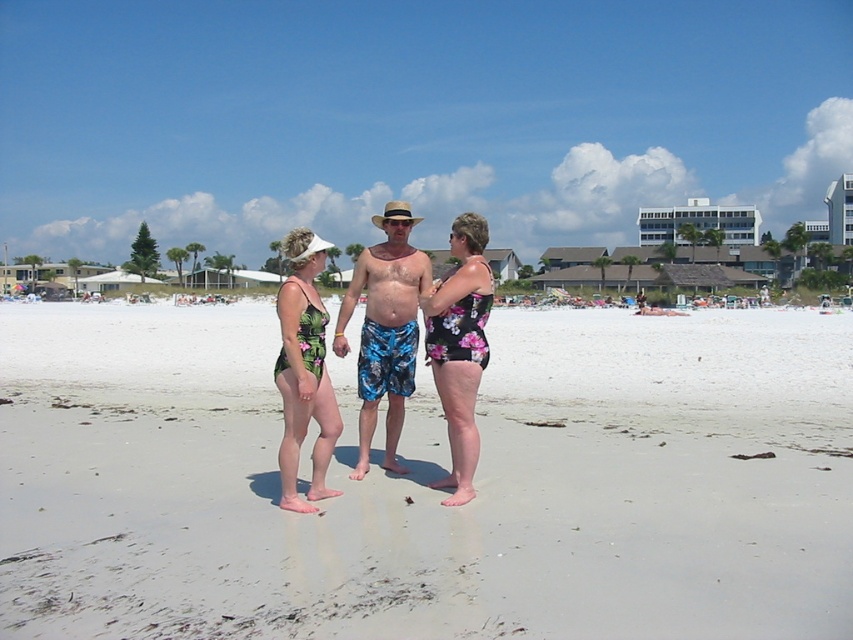
Who is more distant from viewer, (428, 419) or (322, 440)?

Positioned behind is point (428, 419).

Which of these two, white sand at center or green floral swimsuit at center, stands taller?

With more height is green floral swimsuit at center.

Identify the location of white sand at center. (428, 481).

Where is `white sand at center`? The width and height of the screenshot is (853, 640). white sand at center is located at coordinates (428, 481).

Based on the photo, is floral print swimsuit at center positioned in front of black plastic goggles at center?

That is True.

Does floral print swimsuit at center have a larger size compared to black plastic goggles at center?

Indeed, floral print swimsuit at center has a larger size compared to black plastic goggles at center.

Who is more distant from viewer, (x=471, y=212) or (x=409, y=224)?

The point (x=471, y=212) is behind.

Locate an element on the screen. Image resolution: width=853 pixels, height=640 pixels. floral print swimsuit at center is located at coordinates (459, 348).

Can you confirm if white sand at center is shorter than blue printed shorts at center?

Correct, white sand at center is not as tall as blue printed shorts at center.

Between white sand at center and blue printed shorts at center, which one appears on the right side from the viewer's perspective?

white sand at center is more to the right.

The height and width of the screenshot is (640, 853). I want to click on white sand at center, so click(428, 481).